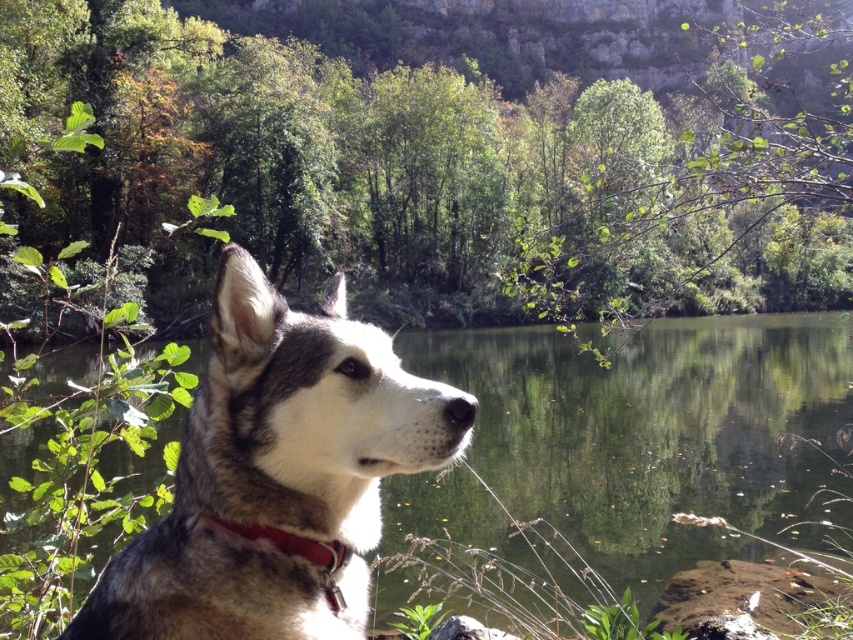
Which is below, green reflective water at center or red leather collar at center?

red leather collar at center is lower down.

Between point (561, 442) and point (323, 568), which one is positioned behind?

Point (561, 442)

Between point (669, 442) and point (320, 545), which one is positioned behind?

Point (669, 442)

Identify the location of green reflective water at center. This screenshot has height=640, width=853. (653, 429).

Which is behind, point (679, 428) or point (335, 333)?

The point (679, 428) is behind.

Consider the image. Does green reflective water at center have a larger size compared to gray fur dog at left?

Yes.

Is point (596, 428) positioned after point (409, 458)?

Yes, point (596, 428) is behind point (409, 458).

Locate an element on the screen. The width and height of the screenshot is (853, 640). green reflective water at center is located at coordinates (653, 429).

Who is positioned more to the left, green leafy tree at upper center or red leather collar at center?

red leather collar at center is more to the left.

Which is behind, point (392, 86) or point (349, 550)?

The point (392, 86) is behind.

Locate an element on the screen. Image resolution: width=853 pixels, height=640 pixels. green leafy tree at upper center is located at coordinates (444, 164).